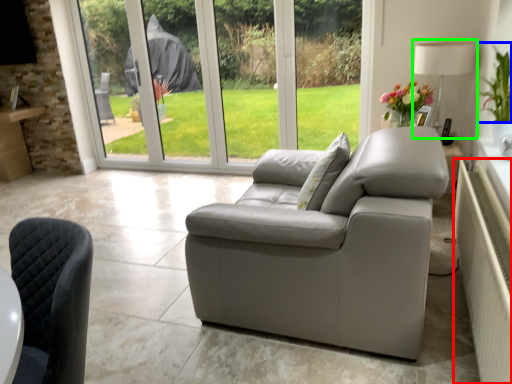
Question: Which object is the closest to the radiator (highlighted by a red box)? Choose among these: plant (highlighted by a blue box) or lamp (highlighted by a green box).

Choices:
 (A) plant
 (B) lamp

Answer: (A)